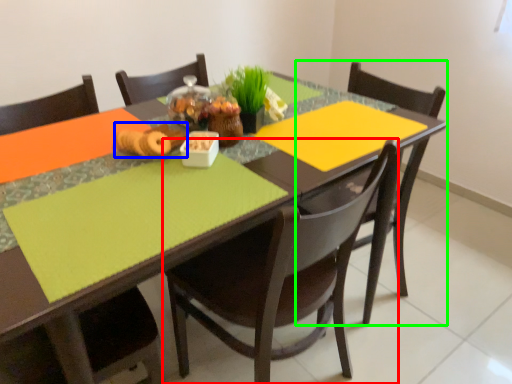
Question: Which object is positioned closest to chair (highlighted by a red box)? Select from food (highlighted by a blue box) and chair (highlighted by a green box).

Choices:
 (A) food
 (B) chair

Answer: (B)